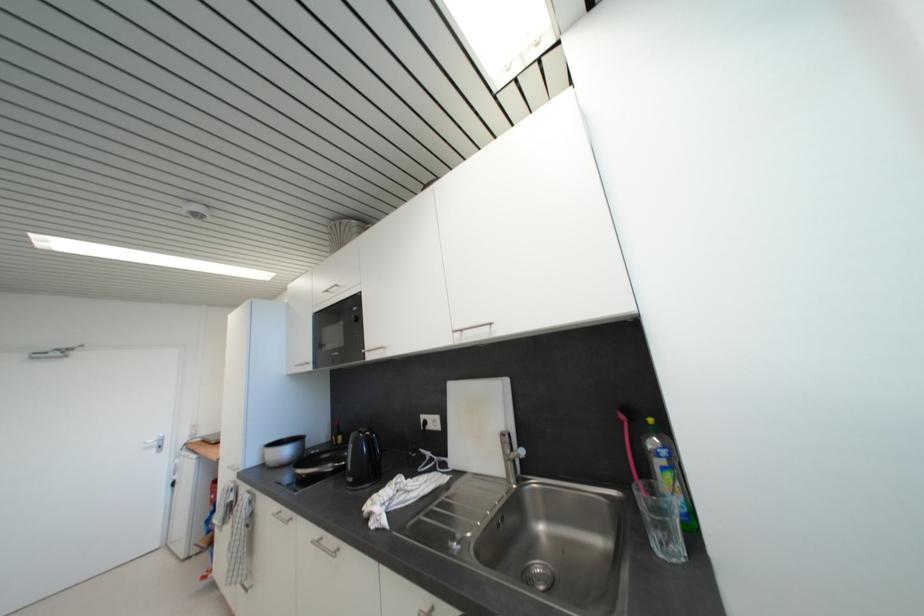
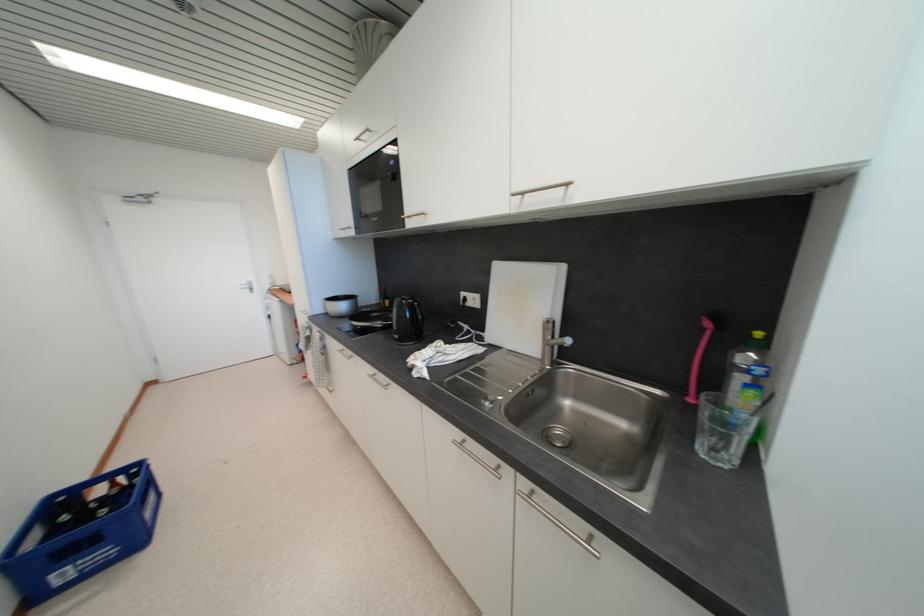
Question: The first image is from the beginning of the video and the second image is from the end. How did the camera likely rotate when shooting the video?

Choices:
 (A) Left
 (B) Right
 (C) Up
 (D) Down

Answer: (D)